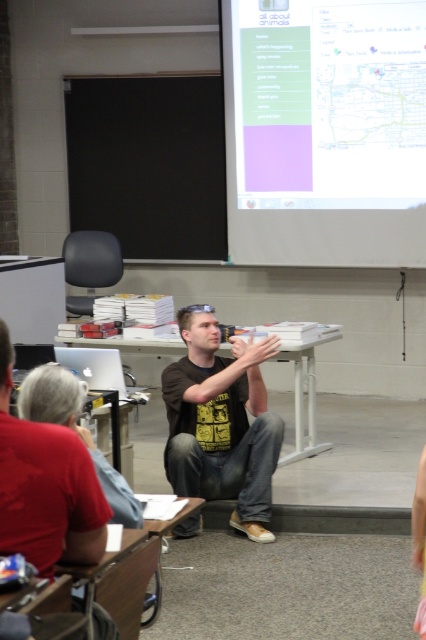
Question: Is black cotton t-shirt at center further to camera compared to matte black laptop at left?

Choices:
 (A) no
 (B) yes

Answer: (B)

Question: Which object is closer to the camera taking this photo?

Choices:
 (A) white plastic table at center
 (B) black cotton t-shirt at center

Answer: (B)

Question: Which object is positioned farthest from the white matte projection screen at upper center?

Choices:
 (A) matte black laptop at left
 (B) white plastic table at center
 (C) red shirt at left

Answer: (A)

Question: Which object is closer to the camera taking this photo?

Choices:
 (A) white matte projection screen at upper center
 (B) red shirt at left

Answer: (B)

Question: Does matte black laptop at left have a lesser width compared to white plastic table at center?

Choices:
 (A) no
 (B) yes

Answer: (B)

Question: Can you confirm if white matte projection screen at upper center is wider than black cotton t-shirt at center?

Choices:
 (A) yes
 (B) no

Answer: (A)